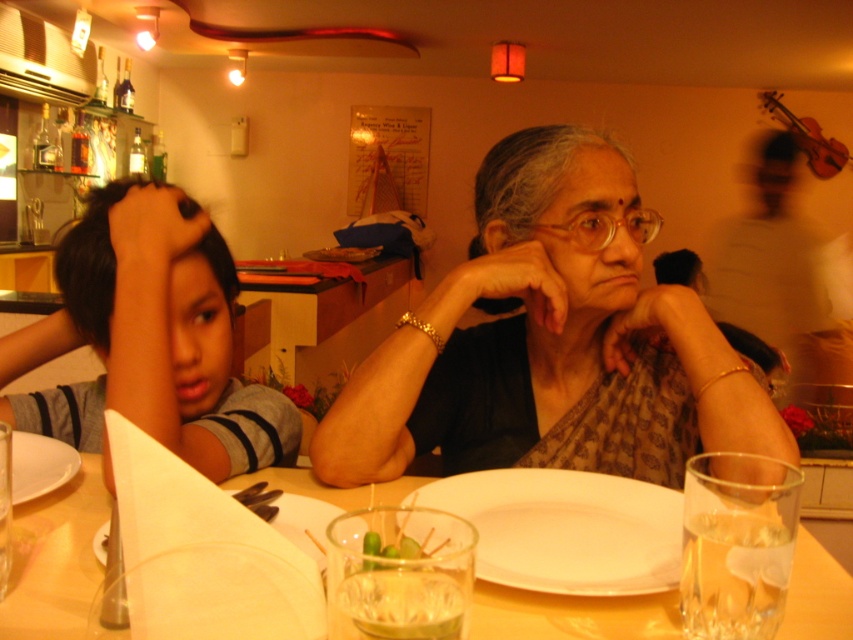
You are a waiter in a restaurant and need to place a new drink order for the guests. The drink should be placed to the left of the white matte plate at center. Where should you place the drink in relation to the brown silk saree at center?

The brown silk saree at center is to the right of the white matte plate at center, so you should place the drink to the left of the white matte plate at center, which would be to the left of the brown silk saree at center.

You are a waiter in a restaurant and need to serve drinks to the guests. You see the clear glass at lower right and the gold metallic glasses at center. Which object should you prioritize replacing if you need to free up space on the table?

The clear glass at lower right occupies less space than the gold metallic glasses at center, so you should prioritize replacing the gold metallic glasses at center to free up more space on the table.